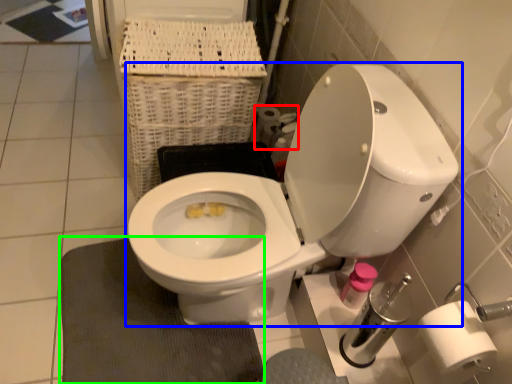
Question: Which object is the closest to the toilet paper (highlighted by a red box)? Choose among these: toilet (highlighted by a blue box) or bath mat (highlighted by a green box).

Choices:
 (A) toilet
 (B) bath mat

Answer: (A)